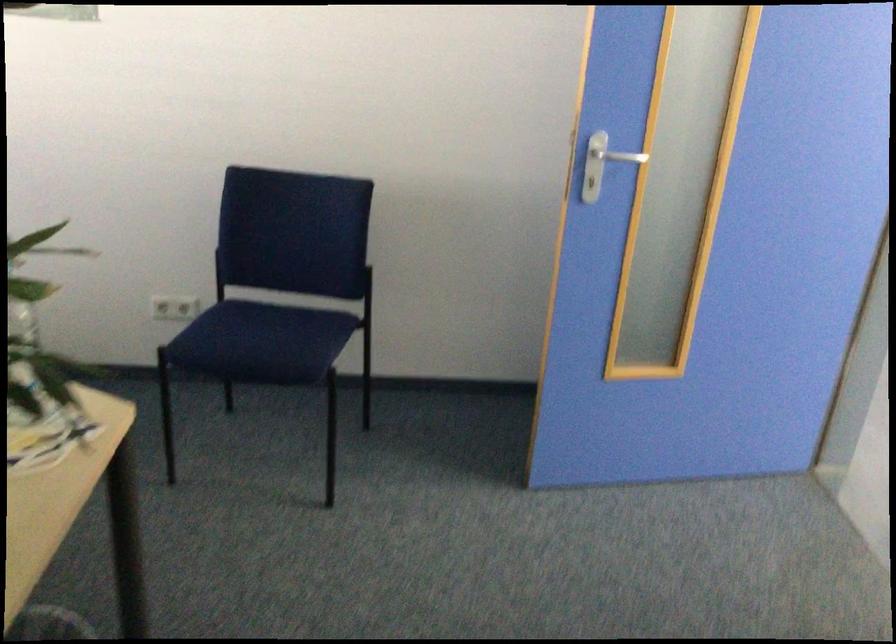
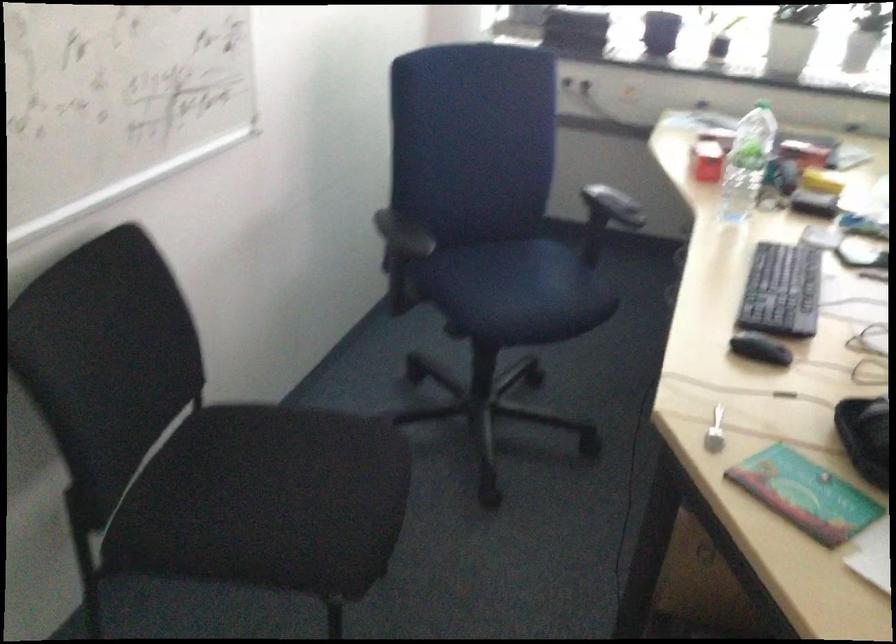
Based on the continuous images, in which direction is the camera rotating?

The camera's rotation is toward left-down.